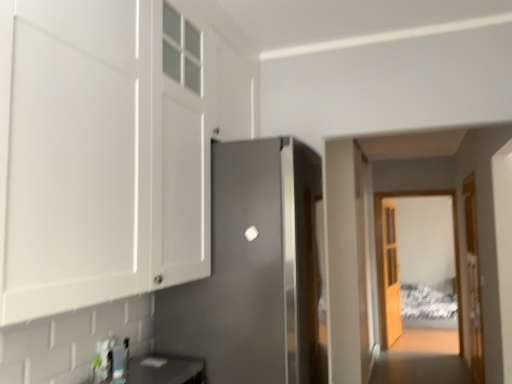
Question: Is wooden textured door at center, positioned as the second door in right-to-left order, taller or shorter than matte black countertop at lower left?

Choices:
 (A) short
 (B) tall

Answer: (B)

Question: From the image's perspective, is wooden textured door at center, marked as the 2th door in a left-to-right arrangement, above or below matte black countertop at lower left?

Choices:
 (A) above
 (B) below

Answer: (B)

Question: Which of these objects is positioned closest to the matte black countertop at lower left?

Choices:
 (A) patterned fabric bed at center
 (B) clear glass door at center
 (C) satin silver refrigerator at center, positioned as the 1th door in left-to-right order
 (D) wooden door at right, which appears as the third door when viewed from the left
 (E) white glossy cabinet at upper left

Answer: (C)

Question: Which of these objects is positioned farthest from the clear glass door at center?

Choices:
 (A) wooden textured door at center, positioned as the second door in right-to-left order
 (B) wooden door at right, the 2th door when ordered from front to back
 (C) satin silver refrigerator at center, which is counted as the 3th door, starting from the right
 (D) matte black countertop at lower left
 (E) white glossy cabinet at upper left

Answer: (E)